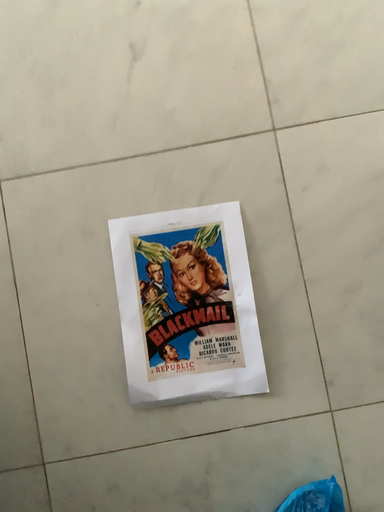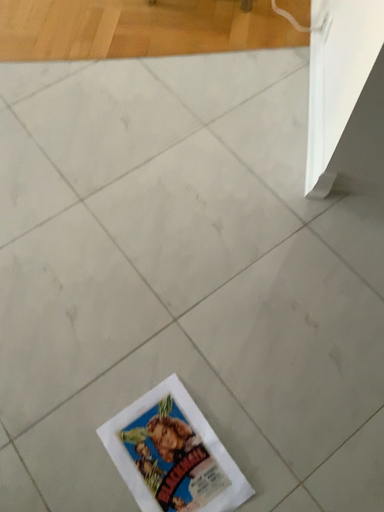
Question: Which way did the camera rotate in the video?

Choices:
 (A) rotated upward
 (B) rotated downward

Answer: (A)